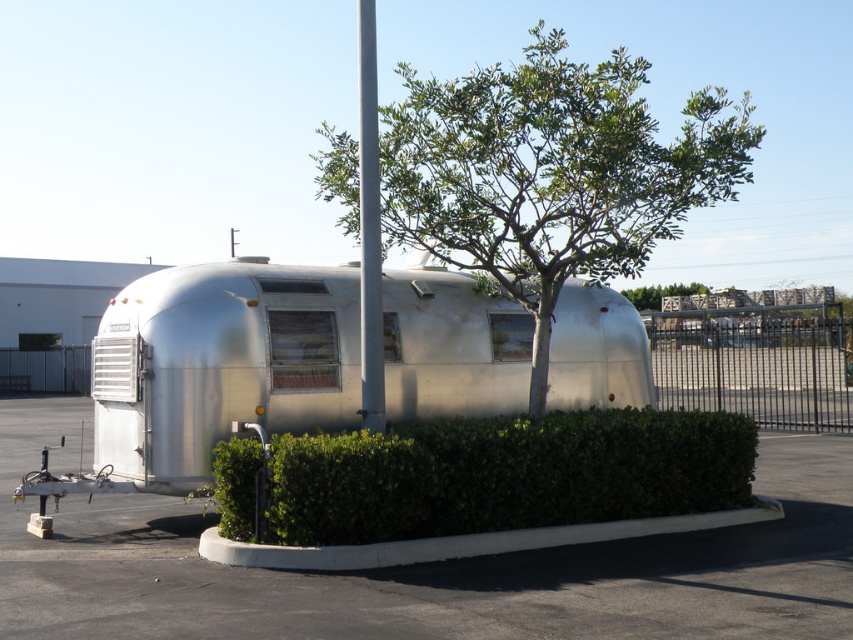
You are standing in front of the vintage Airstream trailer and want to take a photo of the green leafy tree at center without the green leafy hedge at center blocking the view. Which direction should you move to ensure the hedge is out of the frame?

You should move to the side of the trailer away from the green leafy hedge at center. Since the green leafy hedge at center is behind the green leafy tree at center, moving sideways could position the tree in front of the hedge, but since the hedge is behind the tree, you might need to move to a position where the tree is between you and the hedge. Wait, the description says the hedge is behind the tree. So if you are in front of the trailer, the hedge is behind the tree. To avoid the hedge blocking, you do

You are standing in front of the silver metallic trailer at center and want to know where the green leafy tree at upper center is positioned relative to it. Based on the scene, can you determine if the tree is above or below the trailer?

The silver metallic trailer at center is located below the green leafy tree at upper center, so the tree is positioned above the trailer.